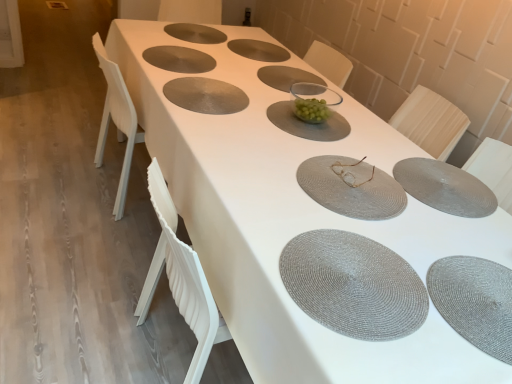
You are a GUI agent. You are given a task and a screenshot of the screen. Output one action in this format:
    pyautogui.click(x=<x>, y=<y>)
    Task: Click on the vacant space that is in between gray woven placemat at center and green glass bowl at center, arranged as the 5th tableware when ordered from the bottom
    The height and width of the screenshot is (384, 512).
    Given the screenshot: What is the action you would take?
    [250, 107]